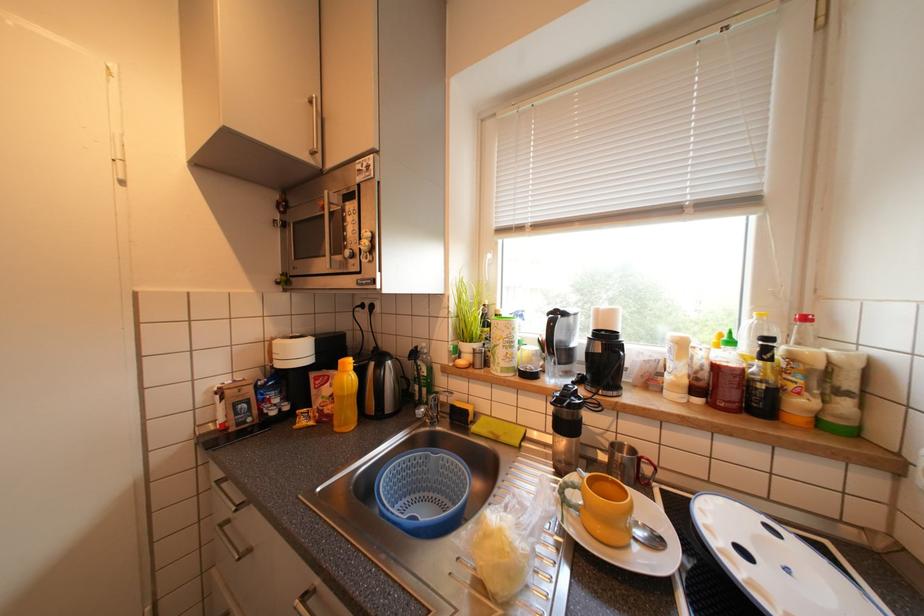
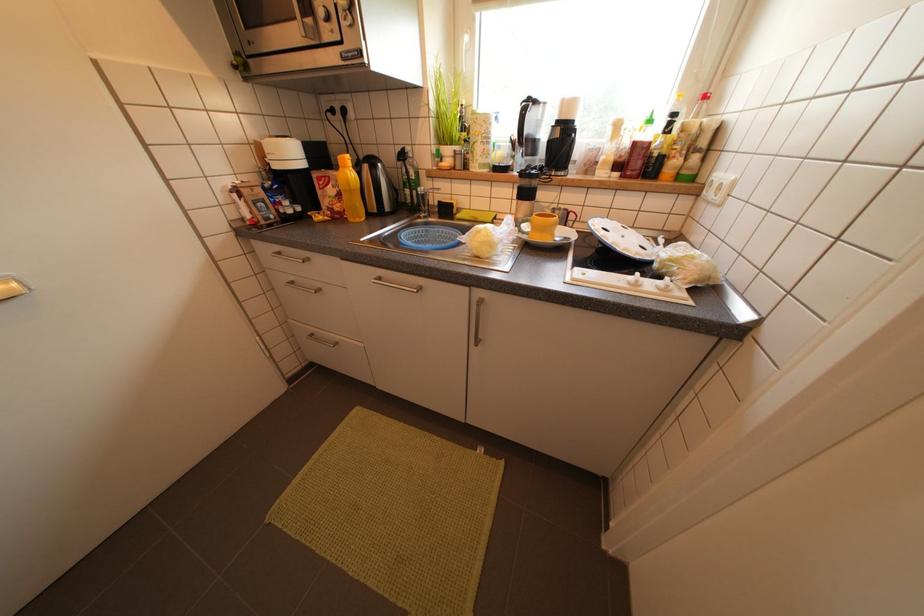
Question: The first image is from the beginning of the video and the second image is from the end. How did the camera likely rotate when shooting the video?

Choices:
 (A) Left
 (B) Right
 (C) Up
 (D) Down

Answer: (D)